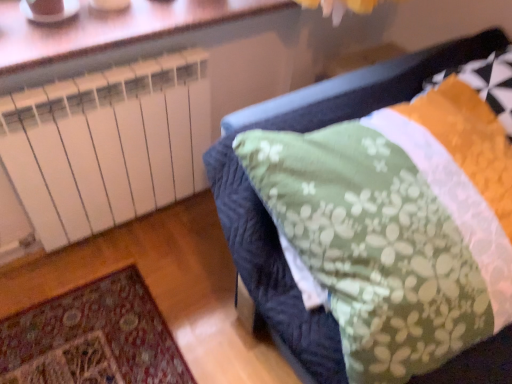
Question: From a real-world perspective, is orange textured pillow at upper right positioned under white plastic radiator at upper left based on gravity?

Choices:
 (A) no
 (B) yes

Answer: (B)

Question: Is white plastic radiator at upper left inside orange textured pillow at upper right?

Choices:
 (A) yes
 (B) no

Answer: (B)

Question: Could you tell me if orange textured pillow at upper right is facing white plastic radiator at upper left?

Choices:
 (A) yes
 (B) no

Answer: (B)

Question: Are orange textured pillow at upper right and white plastic radiator at upper left making contact?

Choices:
 (A) no
 (B) yes

Answer: (A)

Question: Considering the relative sizes of orange textured pillow at upper right and white plastic radiator at upper left in the image provided, is orange textured pillow at upper right taller than white plastic radiator at upper left?

Choices:
 (A) no
 (B) yes

Answer: (B)

Question: From the image's perspective, is orange textured pillow at upper right positioned above or below green floral fabric at center?

Choices:
 (A) below
 (B) above

Answer: (B)

Question: Is orange textured pillow at upper right inside the boundaries of green floral fabric at center, or outside?

Choices:
 (A) outside
 (B) inside

Answer: (B)

Question: From a real-world perspective, relative to green floral fabric at center, is orange textured pillow at upper right vertically above or below?

Choices:
 (A) below
 (B) above

Answer: (B)

Question: Relative to green floral fabric at center, is orange textured pillow at upper right in front or behind?

Choices:
 (A) behind
 (B) front

Answer: (A)

Question: Considering the positions of white plastic radiator at upper left and orange textured pillow at upper right in the image, is white plastic radiator at upper left taller or shorter than orange textured pillow at upper right?

Choices:
 (A) short
 (B) tall

Answer: (A)

Question: Based on their sizes in the image, would you say white plastic radiator at upper left is bigger or smaller than orange textured pillow at upper right?

Choices:
 (A) big
 (B) small

Answer: (B)

Question: From a real-world perspective, is white plastic radiator at upper left physically located above or below orange textured pillow at upper right?

Choices:
 (A) above
 (B) below

Answer: (A)

Question: Based on their positions, is white plastic radiator at upper left located to the left or right of orange textured pillow at upper right?

Choices:
 (A) left
 (B) right

Answer: (A)

Question: Is orange textured pillow at upper right taller or shorter than white plastic radiator at upper left?

Choices:
 (A) short
 (B) tall

Answer: (B)

Question: Is orange textured pillow at upper right inside or outside of white plastic radiator at upper left?

Choices:
 (A) outside
 (B) inside

Answer: (A)